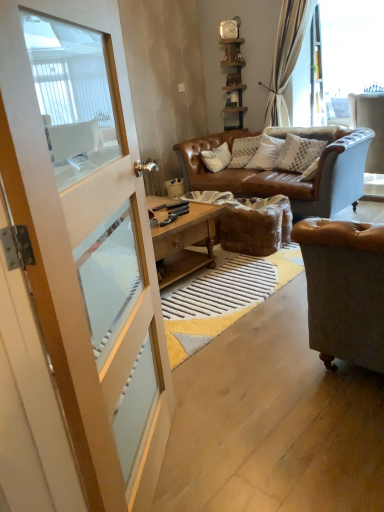
I want to click on vacant area that lies to the right of white wood screen door at left, so click(249, 454).